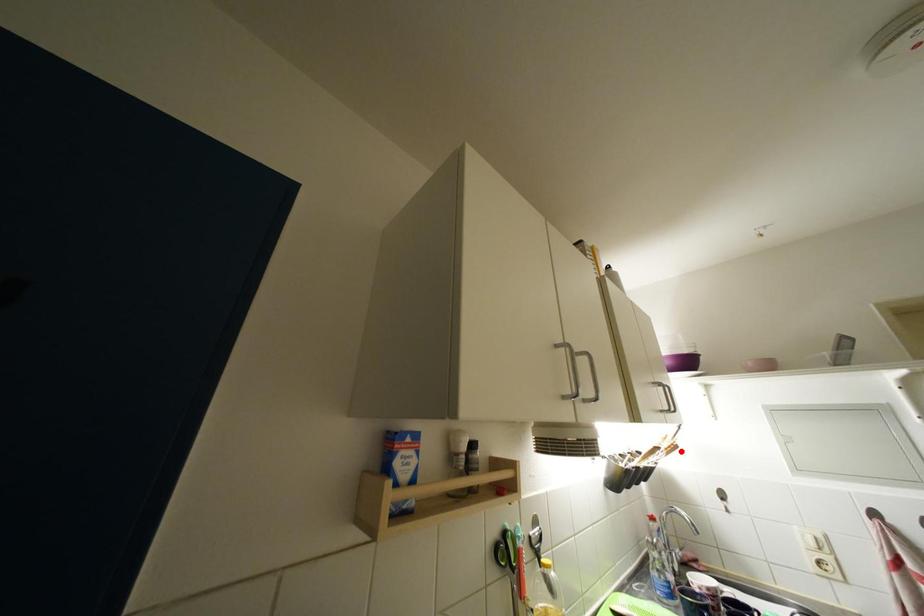
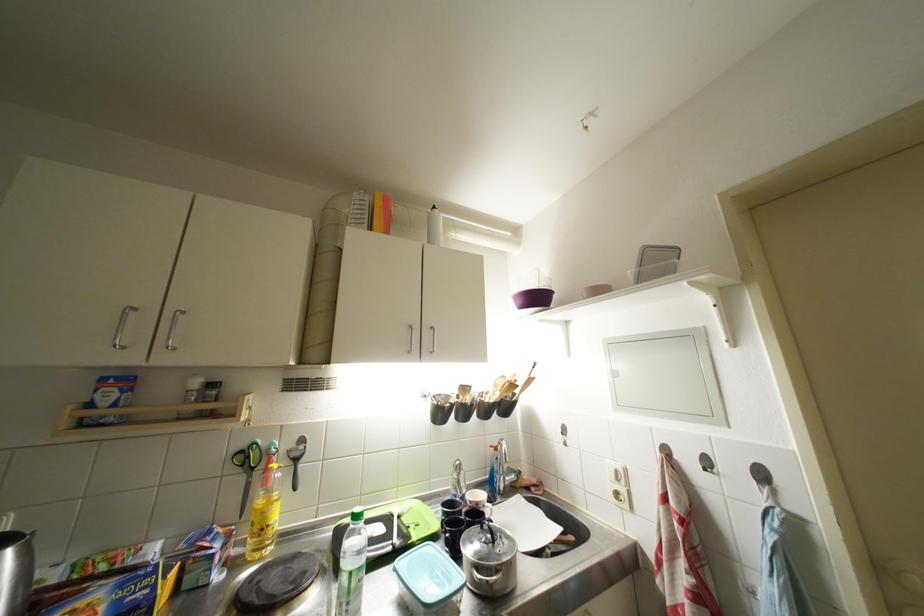
Question: I am providing you with two images of the same scene from different viewpoints. A red point is marked on the first image. Can you still see the location of the red point in image 2?

Choices:
 (A) Yes
 (B) No

Answer: (A)